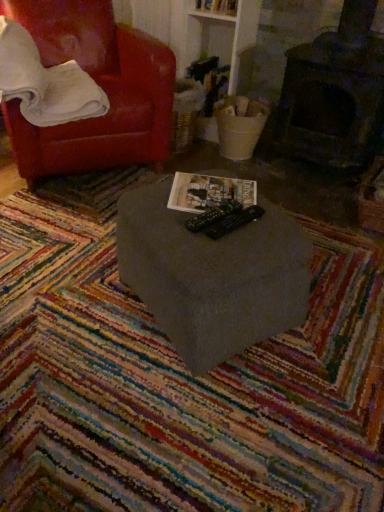
You are a GUI agent. You are given a task and a screenshot of the screen. Output one action in this format:
    pyautogui.click(x=<x>, y=<y>)
    Task: Click on the leather red armchair at left
    This screenshot has height=512, width=384.
    Given the screenshot: What is the action you would take?
    pyautogui.click(x=99, y=85)

What do you see at coordinates (99, 85) in the screenshot? I see `leather red armchair at left` at bounding box center [99, 85].

Identify the location of matte gray table at center. point(212,276).

This screenshot has height=512, width=384. Identify the location of multicolored woven mat at center. (178, 380).

Is leather red armchair at left turned away from white soft pillow at upper left?

Yes.

Which object is more forward, leather red armchair at left or white soft pillow at upper left?

white soft pillow at upper left is in front.

Can you confirm if leather red armchair at left is shorter than white soft pillow at upper left?

No, leather red armchair at left is not shorter than white soft pillow at upper left.

From the picture: Is leather red armchair at left touching white soft pillow at upper left?

There is a gap between leather red armchair at left and white soft pillow at upper left.

The height and width of the screenshot is (512, 384). Find the location of `table in front of the matte paper magazine at center`. table in front of the matte paper magazine at center is located at coordinates (212, 276).

Is matte gray table at center smaller than matte paper magazine at center?

Actually, matte gray table at center might be larger than matte paper magazine at center.

Between matte gray table at center and matte paper magazine at center, which one has more height?

matte gray table at center is taller.

Which of these two, matte gray table at center or matte paper magazine at center, is wider?

Wider between the two is matte gray table at center.

Is matte paper magazine at center completely or partially inside white soft pillow at upper left?

Definitely not — matte paper magazine at center is not inside white soft pillow at upper left.

Measure the distance between white soft pillow at upper left and matte paper magazine at center.

white soft pillow at upper left and matte paper magazine at center are 30.83 inches apart.

Considering the relative sizes of white soft pillow at upper left and matte paper magazine at center in the image provided, is white soft pillow at upper left smaller than matte paper magazine at center?

No, white soft pillow at upper left is not smaller than matte paper magazine at center.

Between white soft pillow at upper left and matte paper magazine at center, which one has smaller width?

With smaller width is matte paper magazine at center.

From a real-world perspective, is multicolored woven mat at center above or below white soft pillow at upper left?

In terms of real-world spatial position, multicolored woven mat at center is below white soft pillow at upper left.

This screenshot has height=512, width=384. I want to click on mat directly beneath the white soft pillow at upper left (from a real-world perspective), so click(178, 380).

Which of these two, multicolored woven mat at center or white soft pillow at upper left, is thinner?

Thinner between the two is white soft pillow at upper left.

Does point (79, 309) lie in front of point (59, 114)?

That is True.

Is matte gray table at center at the right side of multicolored woven mat at center?

Yes, matte gray table at center is to the right of multicolored woven mat at center.

Considering the relative sizes of matte gray table at center and multicolored woven mat at center in the image provided, is matte gray table at center taller than multicolored woven mat at center?

Correct, matte gray table at center is much taller as multicolored woven mat at center.

Is matte gray table at center located outside multicolored woven mat at center?

matte gray table at center is positioned outside multicolored woven mat at center.

Based on their sizes in the image, would you say matte gray table at center is bigger or smaller than multicolored woven mat at center?

matte gray table at center is smaller than multicolored woven mat at center.

Looking at this image, is matte paper magazine at center not inside matte gray table at center?

No, matte paper magazine at center is not entirely external to matte gray table at center.

Considering the sizes of objects matte paper magazine at center and matte gray table at center in the image provided, who is thinner, matte paper magazine at center or matte gray table at center?

Thinner between the two is matte paper magazine at center.

Could you tell me if matte paper magazine at center is facing matte gray table at center?

Yes, matte paper magazine at center is facing matte gray table at center.

Measure the distance from matte paper magazine at center to matte gray table at center.

8.25 inches.

Does point (26, 279) come farther from viewer compared to point (110, 116)?

No, (26, 279) is closer to viewer.

Does multicolored woven mat at center have a lesser height compared to leather red armchair at left?

Yes.

Is leather red armchair at left completely or partially inside multicolored woven mat at center?

Actually, leather red armchair at left is outside multicolored woven mat at center.

Find the location of a particular element. The width and height of the screenshot is (384, 512). pillow to the left of leather red armchair at left is located at coordinates (45, 82).

At what (x,y) coordinates should I click in order to perform the action: click on magazine that is on the right side of matte gray table at center. Please return your answer as a coordinate pair (x, y). The width and height of the screenshot is (384, 512). Looking at the image, I should click on (209, 192).

When comparing their distances from multicolored woven mat at center, does white soft pillow at upper left or leather red armchair at left seem closer?

Among the two, white soft pillow at upper left is located nearer to multicolored woven mat at center.

When comparing their distances from matte gray table at center, does leather red armchair at left or matte paper magazine at center seem closer?

Among the two, matte paper magazine at center is located nearer to matte gray table at center.

Based on their spatial positions, is matte paper magazine at center or leather red armchair at left closer to white soft pillow at upper left?

leather red armchair at left is positioned closer to the anchor white soft pillow at upper left.

Based on their spatial positions, is matte gray table at center or matte paper magazine at center further from multicolored woven mat at center?

The object further to multicolored woven mat at center is matte paper magazine at center.

From the image, which object appears to be nearer to leather red armchair at left, white soft pillow at upper left or matte gray table at center?

The object closer to leather red armchair at left is white soft pillow at upper left.

Considering their positions, is matte gray table at center positioned further to leather red armchair at left than multicolored woven mat at center?

Among the two, multicolored woven mat at center is located further to leather red armchair at left.

Considering their positions, is multicolored woven mat at center positioned further to matte gray table at center than white soft pillow at upper left?

white soft pillow at upper left is further to matte gray table at center.

From the image, which object appears to be farther from multicolored woven mat at center, matte paper magazine at center or white soft pillow at upper left?

Based on the image, white soft pillow at upper left appears to be further to multicolored woven mat at center.

The image size is (384, 512). Find the location of `table between leather red armchair at left and multicolored woven mat at center in the vertical direction`. table between leather red armchair at left and multicolored woven mat at center in the vertical direction is located at coordinates (212, 276).

Locate an element on the screen. pillow that lies between leather red armchair at left and matte paper magazine at center from top to bottom is located at coordinates (45, 82).

Identify the location of magazine between leather red armchair at left and matte gray table at center from top to bottom. This screenshot has height=512, width=384. (209, 192).

Identify the location of magazine between white soft pillow at upper left and matte gray table at center in the up-down direction. (209, 192).